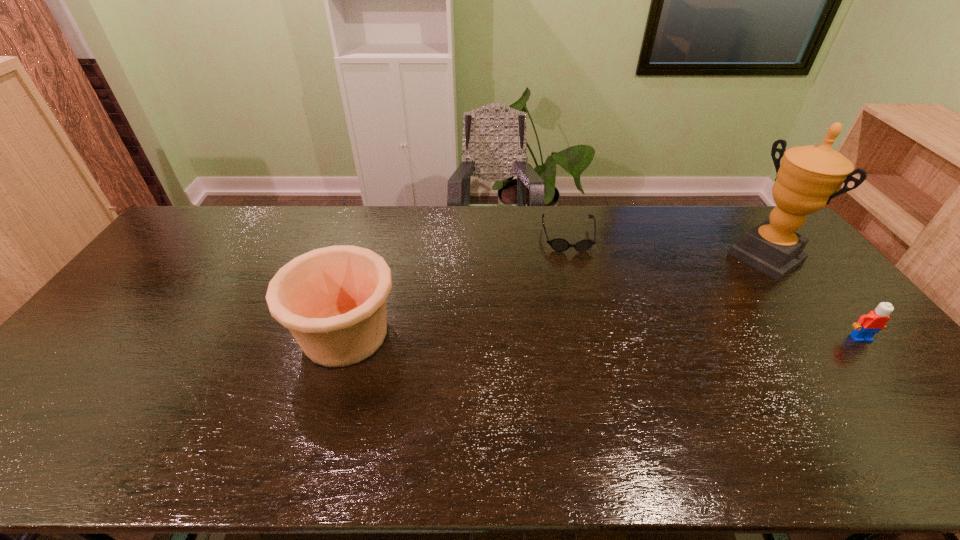
In order to click on vacant space on the desktop that is between the pottery and the Lego and is positioned at the front of the tallest object with handles in this screenshot , I will do `click(652, 336)`.

Where is `free spot on the desktop that is between the second tallest object and the second shortest object and is positioned on the lenses of the third object from right to left`? The image size is (960, 540). free spot on the desktop that is between the second tallest object and the second shortest object and is positioned on the lenses of the third object from right to left is located at coordinates (588, 336).